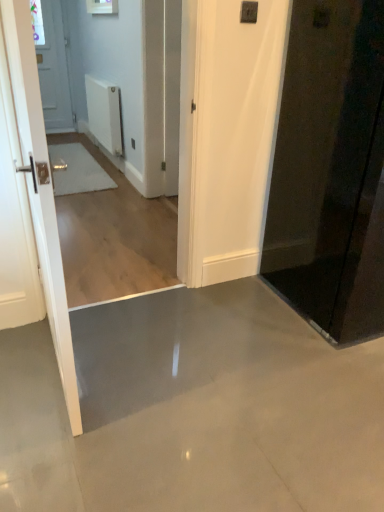
Describe the element at coordinates (104, 113) in the screenshot. I see `white matte radiator at upper center` at that location.

This screenshot has width=384, height=512. What do you see at coordinates (38, 183) in the screenshot?
I see `white glossy door at left, arranged as the 1th door when viewed from the left` at bounding box center [38, 183].

Identify the location of white matte radiator at upper center. This screenshot has width=384, height=512. (104, 113).

From the image's perspective, is black glossy door at right, the first door in the right-to-left sequence, below white matte radiator at upper center?

Yes, from the image's perspective, black glossy door at right, the first door in the right-to-left sequence, is below white matte radiator at upper center.

Considering the sizes of black glossy door at right, the 2th door in the left-to-right sequence, and white matte radiator at upper center in the image, is black glossy door at right, the 2th door in the left-to-right sequence, taller or shorter than white matte radiator at upper center?

Clearly, black glossy door at right, the 2th door in the left-to-right sequence, is taller compared to white matte radiator at upper center.

Is point (370, 304) positioned after point (109, 94)?

No, it is in front of (109, 94).

Considering the relative positions of black glossy door at right, the 2th door in the left-to-right sequence, and white matte radiator at upper center in the image provided, is black glossy door at right, the 2th door in the left-to-right sequence, to the left of white matte radiator at upper center from the viewer's perspective?

No.

From the image's perspective, is white matte radiator at upper center beneath black glossy door at right, the first door in the right-to-left sequence?

Incorrect, from the image's perspective, white matte radiator at upper center is higher than black glossy door at right, the first door in the right-to-left sequence.

This screenshot has width=384, height=512. In order to click on radiator that is above the black glossy door at right, the first door in the right-to-left sequence (from the image's perspective) in this screenshot , I will do click(104, 113).

Which point is more forward, (94, 108) or (310, 186)?

The point (310, 186) is in front.

From a real-world perspective, which object rests below the other?

From a 3D spatial view, white matte radiator at upper center is below.

From the image's perspective, is white glossy door at left, arranged as the 1th door when viewed from the left, below black glossy door at right, the first door in the right-to-left sequence?

Yes, from the image's perspective, white glossy door at left, arranged as the 1th door when viewed from the left, is beneath black glossy door at right, the first door in the right-to-left sequence.

Which of these two, white glossy door at left, arranged as the 1th door when viewed from the left, or black glossy door at right, the 2th door in the left-to-right sequence, stands shorter?

white glossy door at left, arranged as the 1th door when viewed from the left, is shorter.

Considering the relative sizes of white glossy door at left, arranged as the 1th door when viewed from the left, and black glossy door at right, the 2th door in the left-to-right sequence, in the image provided, is white glossy door at left, arranged as the 1th door when viewed from the left, bigger than black glossy door at right, the 2th door in the left-to-right sequence,?

No.

Is white glossy door at left, arranged as the 1th door when viewed from the left, positioned with its back to white matte radiator at upper center?

No, white glossy door at left, arranged as the 1th door when viewed from the left,'s orientation is not away from white matte radiator at upper center.

Can you tell me how much white glossy door at left, arranged as the 1th door when viewed from the left, and white matte radiator at upper center differ in facing direction?

The angular difference between white glossy door at left, arranged as the 1th door when viewed from the left, and white matte radiator at upper center is 178 degrees.

The height and width of the screenshot is (512, 384). Identify the location of radiator that appears above the white glossy door at left, arranged as the 1th door when viewed from the left (from the image's perspective). (104, 113).

From the image's perspective, is white glossy door at left, arranged as the 1th door when viewed from the left, positioned above or below white matte radiator at upper center?

From the image's perspective, white glossy door at left, arranged as the 1th door when viewed from the left, appears below white matte radiator at upper center.

Does black glossy door at right, the 2th door in the left-to-right sequence, touch white glossy door at left, arranged as the 2th door when viewed from the right?

black glossy door at right, the 2th door in the left-to-right sequence, is not next to white glossy door at left, arranged as the 2th door when viewed from the right, and they're not touching.

Is point (340, 195) less distant than point (44, 275)?

No, (340, 195) is behind (44, 275).

Which of these two, black glossy door at right, the 2th door in the left-to-right sequence, or white glossy door at left, arranged as the 2th door when viewed from the right, is thinner?

With smaller width is white glossy door at left, arranged as the 2th door when viewed from the right.

Is black glossy door at right, the first door in the right-to-left sequence, taller than white glossy door at left, arranged as the 1th door when viewed from the left?

Indeed, black glossy door at right, the first door in the right-to-left sequence, has a greater height compared to white glossy door at left, arranged as the 1th door when viewed from the left.

Considering the relative sizes of white matte radiator at upper center and white glossy door at left, arranged as the 2th door when viewed from the right, in the image provided, is white matte radiator at upper center taller than white glossy door at left, arranged as the 2th door when viewed from the right,?

No.

Is point (118, 126) closer or farther from the camera than point (70, 357)?

Point (118, 126) is farther from the camera than point (70, 357).

The height and width of the screenshot is (512, 384). In order to click on door that is the 1st one when counting rightward from the white matte radiator at upper center in this screenshot , I will do `click(38, 183)`.

From a real-world perspective, is white matte radiator at upper center under white glossy door at left, arranged as the 2th door when viewed from the right?

Indeed, from a real-world perspective, white matte radiator at upper center is positioned beneath white glossy door at left, arranged as the 2th door when viewed from the right.

Identify the location of radiator below the black glossy door at right, the 2th door in the left-to-right sequence (from a real-world perspective). The width and height of the screenshot is (384, 512). (104, 113).

From the image's perspective, which door is the 1st one below the white matte radiator at upper center? Please provide its 2D coordinates.

[(330, 170)]

When comparing their distances from white matte radiator at upper center, does white glossy door at left, arranged as the 1th door when viewed from the left, or black glossy door at right, the first door in the right-to-left sequence, seem further?

Among the two, white glossy door at left, arranged as the 1th door when viewed from the left, is located further to white matte radiator at upper center.

Based on their spatial positions, is black glossy door at right, the first door in the right-to-left sequence, or white glossy door at left, arranged as the 2th door when viewed from the right, closer to white matte radiator at upper center?

black glossy door at right, the first door in the right-to-left sequence, is positioned closer to the anchor white matte radiator at upper center.

Looking at the image, which one is located closer to black glossy door at right, the first door in the right-to-left sequence, white glossy door at left, arranged as the 1th door when viewed from the left, or white matte radiator at upper center?

The object closer to black glossy door at right, the first door in the right-to-left sequence, is white glossy door at left, arranged as the 1th door when viewed from the left.

Which object lies nearer to the anchor point black glossy door at right, the first door in the right-to-left sequence, white matte radiator at upper center or white glossy door at left, arranged as the 2th door when viewed from the right?

white glossy door at left, arranged as the 2th door when viewed from the right, lies closer to black glossy door at right, the first door in the right-to-left sequence, than the other object.

Looking at the image, which one is located closer to white glossy door at left, arranged as the 1th door when viewed from the left, black glossy door at right, the 2th door in the left-to-right sequence, or white matte radiator at upper center?

black glossy door at right, the 2th door in the left-to-right sequence, is positioned closer to the anchor white glossy door at left, arranged as the 1th door when viewed from the left.

Based on their spatial positions, is white matte radiator at upper center or black glossy door at right, the 2th door in the left-to-right sequence, closer to white glossy door at left, arranged as the 1th door when viewed from the left?

black glossy door at right, the 2th door in the left-to-right sequence, is positioned closer to the anchor white glossy door at left, arranged as the 1th door when viewed from the left.

Where is `door positioned between white glossy door at left, arranged as the 1th door when viewed from the left, and white matte radiator at upper center from near to far`? door positioned between white glossy door at left, arranged as the 1th door when viewed from the left, and white matte radiator at upper center from near to far is located at coordinates (330, 170).